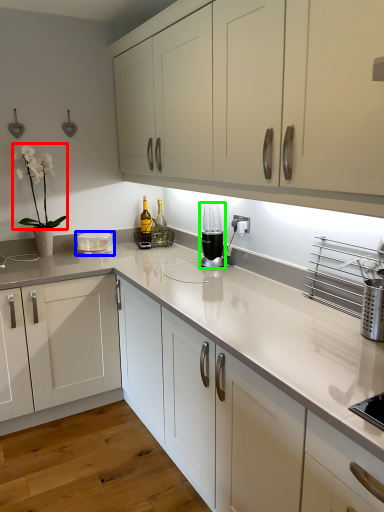
Question: Which object is positioned farthest from plant (highlighted by a red box)? Select from appliance (highlighted by a blue box) and home appliance (highlighted by a green box).

Choices:
 (A) appliance
 (B) home appliance

Answer: (B)